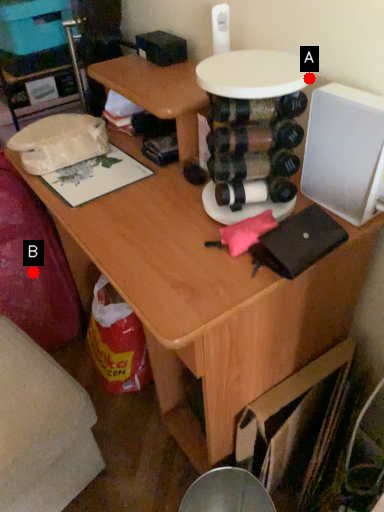
Question: Two points are circled on the image, labeled by A and B beside each circle. Which point is further to the camera?

Choices:
 (A) A is further
 (B) B is further

Answer: (B)